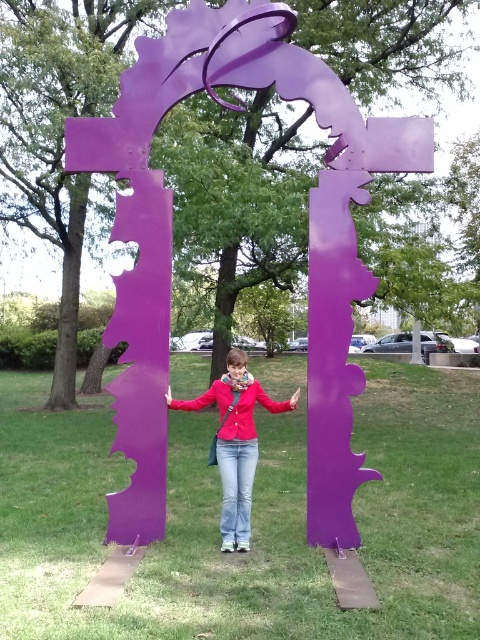
From the picture: Does purple metallic sculpture at center appear on the right side of matte purple scarf at center?

Correct, you'll find purple metallic sculpture at center to the right of matte purple scarf at center.

Can you confirm if purple metallic sculpture at center is positioned to the left of matte purple scarf at center?

In fact, purple metallic sculpture at center is to the right of matte purple scarf at center.

Which is in front, point (292, 88) or point (251, 388)?

Positioned in front is point (292, 88).

Find the location of a particular element. purple metallic sculpture at center is located at coordinates (170, 243).

Which is above, purple matte arch at center or purple metallic sculpture at center?

purple metallic sculpture at center is above.

Is purple matte arch at center shorter than purple metallic sculpture at center?

Yes, purple matte arch at center is shorter than purple metallic sculpture at center.

Which is in front, point (46, 484) or point (154, 465)?

Point (154, 465)

This screenshot has height=640, width=480. In order to click on purple matte arch at center in this screenshot , I will do `click(252, 522)`.

What do you see at coordinates (252, 522) in the screenshot? This screenshot has width=480, height=640. I see `purple matte arch at center` at bounding box center [252, 522].

Between purple matte arch at center and matte purple scarf at center, which one is positioned higher?

matte purple scarf at center is higher up.

Is point (355, 440) closer to viewer compared to point (244, 356)?

No, it is behind (244, 356).

This screenshot has height=640, width=480. In order to click on purple matte arch at center in this screenshot , I will do `click(252, 522)`.